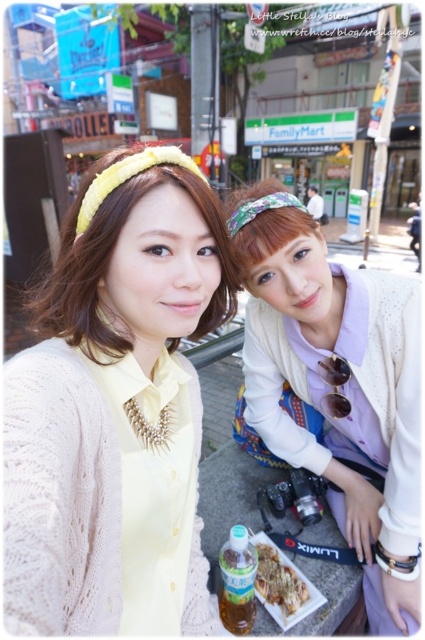
Question: Considering the relative positions of matte yellow headband at upper center and translucent plastic bottle at lower center in the image provided, where is matte yellow headband at upper center located with respect to translucent plastic bottle at lower center?

Choices:
 (A) right
 (B) left

Answer: (B)

Question: Does white knit cardigan at lower right have a larger size compared to translucent plastic bottle at lower center?

Choices:
 (A) no
 (B) yes

Answer: (B)

Question: Which of these objects is positioned closest to the matte yellow headband at upper center?

Choices:
 (A) translucent plastic bottle at lower center
 (B) white knit cardigan at lower right

Answer: (B)

Question: Which object is positioned farthest from the matte yellow headband at upper center?

Choices:
 (A) white knit cardigan at lower right
 (B) translucent plastic bottle at lower center

Answer: (B)

Question: Observing the image, what is the correct spatial positioning of white knit cardigan at lower right in reference to matte yellow headband at upper center?

Choices:
 (A) right
 (B) left

Answer: (A)

Question: Which is nearer to the matte yellow headband at upper center?

Choices:
 (A) matte yellow cardigan at center
 (B) white knit cardigan at lower right
 (C) translucent plastic bottle at lower center

Answer: (A)